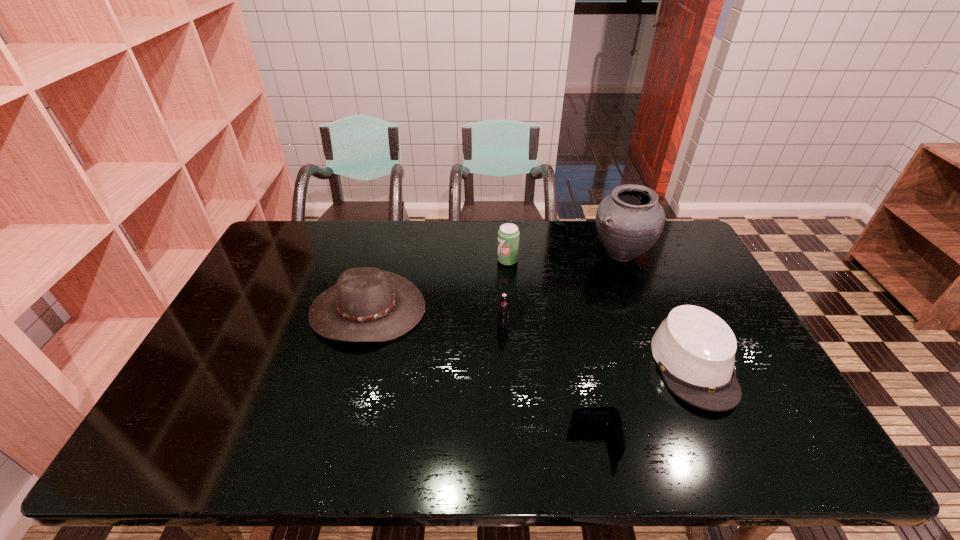
Where is `vacant area that lies between the tallest object and the farther pop`? The width and height of the screenshot is (960, 540). vacant area that lies between the tallest object and the farther pop is located at coordinates (564, 258).

The image size is (960, 540). Identify the location of vacant region between the urn and the farther pop. (564, 258).

Find the location of a particular element. This screenshot has height=540, width=960. unoccupied position between the shorter pop and the right hat is located at coordinates (598, 345).

You are a GUI agent. You are given a task and a screenshot of the screen. Output one action in this format:
    pyautogui.click(x=<x>, y=<y>)
    Task: Click on the free point between the urn and the nearest object
    This screenshot has height=540, width=960.
    Given the screenshot: What is the action you would take?
    pyautogui.click(x=608, y=349)

In order to click on vacant space that is in between the tallest object and the nearer pop in this screenshot , I will do `click(562, 289)`.

Locate an element on the screen. object that stands as the fourth closest to the left hat is located at coordinates (629, 222).

Identify which object is the second nearest to the farther pop. Please provide its 2D coordinates. Your answer should be formatted as a tuple, i.e. [(x, y)], where the tuple contains the x and y coordinates of a point satisfying the conditions above.

[(503, 309)]

The height and width of the screenshot is (540, 960). I want to click on vacant region that satisfies the following two spatial constraints: 1. on the front-facing side of the right hat; 2. on the outer surface of the shortest object, so click(729, 443).